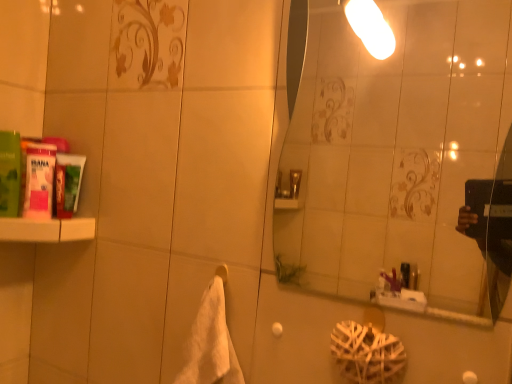
Question: Considering the relative sizes of white matte shelf at left and green matte tube at left, which appears as the third mouthwash when viewed from the left, in the image provided, is white matte shelf at left shorter than green matte tube at left, which appears as the third mouthwash when viewed from the left,?

Choices:
 (A) no
 (B) yes

Answer: (B)

Question: From a real-world perspective, does white matte shelf at left stand above green matte tube at left, which appears as the third mouthwash when viewed from the left?

Choices:
 (A) yes
 (B) no

Answer: (B)

Question: Considering the relative positions of white matte shelf at left and green matte tube at left, which appears as the third mouthwash when viewed from the left, in the image provided, is white matte shelf at left behind green matte tube at left, which appears as the third mouthwash when viewed from the left,?

Choices:
 (A) yes
 (B) no

Answer: (B)

Question: From the image's perspective, is white matte shelf at left below green matte tube at left, the first mouthwash in the right-to-left sequence?

Choices:
 (A) no
 (B) yes

Answer: (B)

Question: From the image's perspective, does white matte shelf at left appear higher than green matte tube at left, which appears as the third mouthwash when viewed from the left?

Choices:
 (A) yes
 (B) no

Answer: (B)

Question: Is point (15, 153) positioned closer to the camera than point (201, 306)?

Choices:
 (A) farther
 (B) closer

Answer: (A)

Question: Looking at their shapes, would you say green matte mouthwash at left, the 1th mouthwash in the left-to-right sequence, is wider or thinner than white soft towel at center?

Choices:
 (A) thin
 (B) wide

Answer: (B)

Question: From a real-world perspective, is green matte mouthwash at left, the 3th mouthwash from the right, physically located above or below white soft towel at center?

Choices:
 (A) below
 (B) above

Answer: (B)

Question: Relative to white soft towel at center, is green matte mouthwash at left, the 1th mouthwash in the left-to-right sequence, in front or behind?

Choices:
 (A) front
 (B) behind

Answer: (B)

Question: In the image, is white soft towel at center positioned in front of or behind white matte shelf at left?

Choices:
 (A) behind
 (B) front

Answer: (B)

Question: Is point coord(194,380) positioned closer to the camera than point coord(53,221)?

Choices:
 (A) closer
 (B) farther

Answer: (A)

Question: From a real-world perspective, relative to white matte shelf at left, is white soft towel at center vertically above or below?

Choices:
 (A) below
 (B) above

Answer: (A)

Question: Considering the positions of white soft towel at center and white matte shelf at left in the image, is white soft towel at center taller or shorter than white matte shelf at left?

Choices:
 (A) tall
 (B) short

Answer: (A)

Question: Looking at the image, does white matte towel bar at lower center seem bigger or smaller compared to transparent glass mirror at upper center?

Choices:
 (A) small
 (B) big

Answer: (A)

Question: Is white matte towel bar at lower center in front of or behind transparent glass mirror at upper center in the image?

Choices:
 (A) front
 (B) behind

Answer: (B)